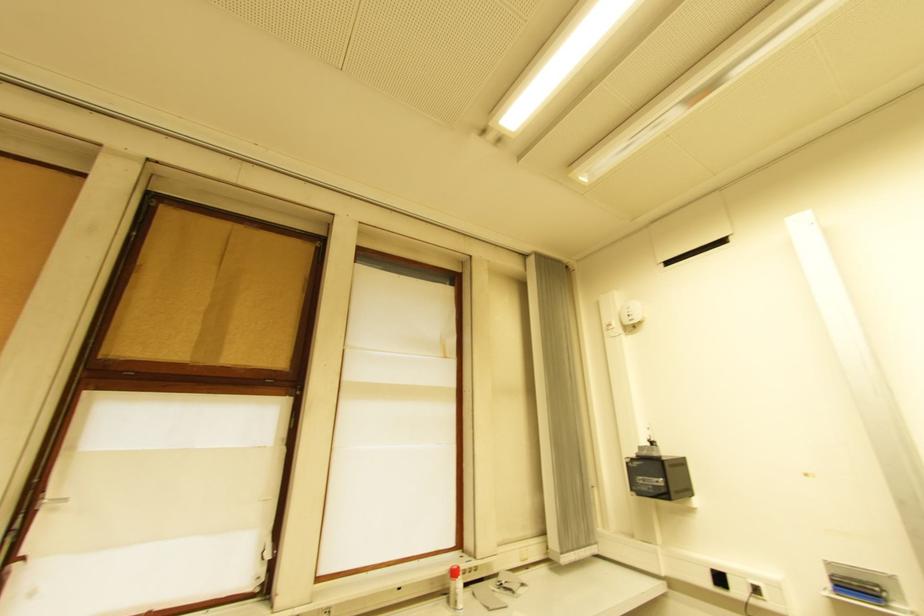
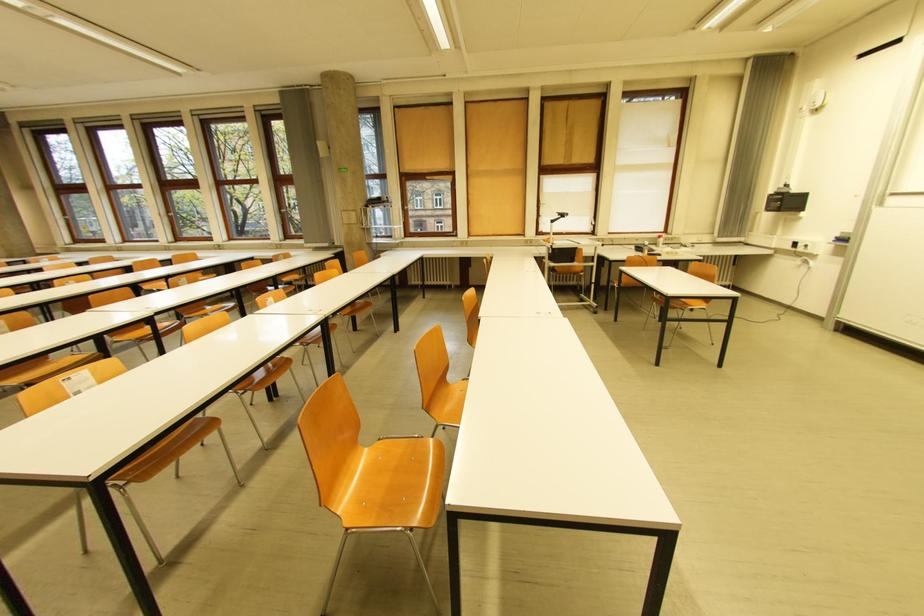
In the second image, find the point that corresponds to [450,578] in the first image.

(662, 240)